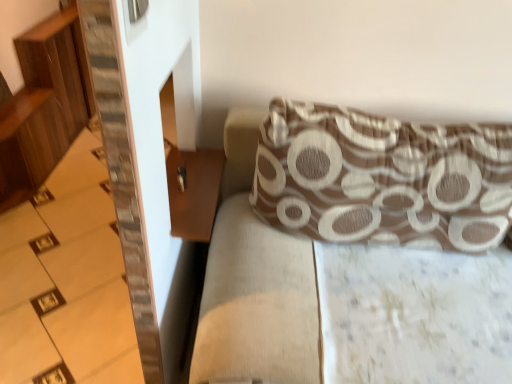
Where is `empty space that is ontop of brown wooden table at lower left (from a real-world perspective)`? This screenshot has height=384, width=512. empty space that is ontop of brown wooden table at lower left (from a real-world perspective) is located at coordinates (200, 188).